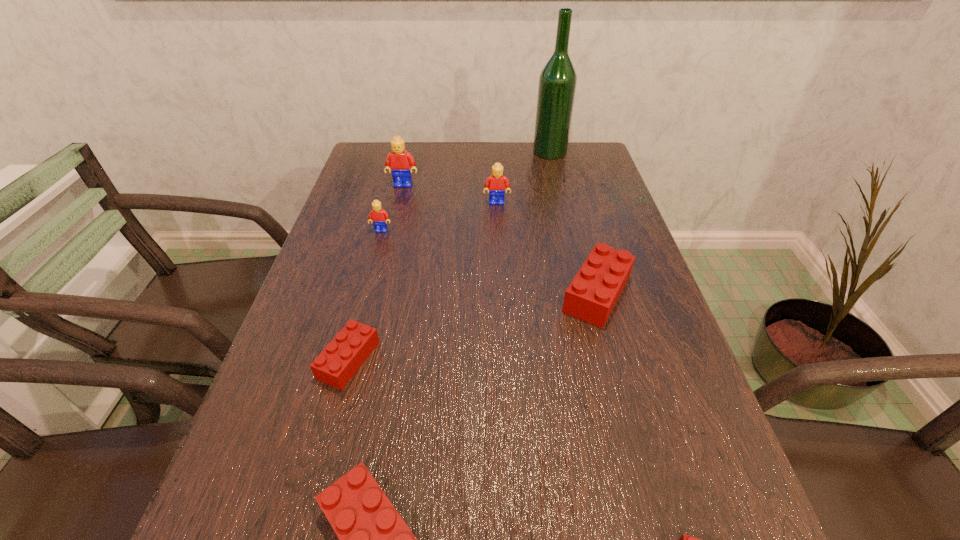
Locate an element on the screen. free location that satisfies the following two spatial constraints: 1. on the front-facing side of the fourth tallest Lego; 2. on the right side of the fifth nearest Lego is located at coordinates (365, 293).